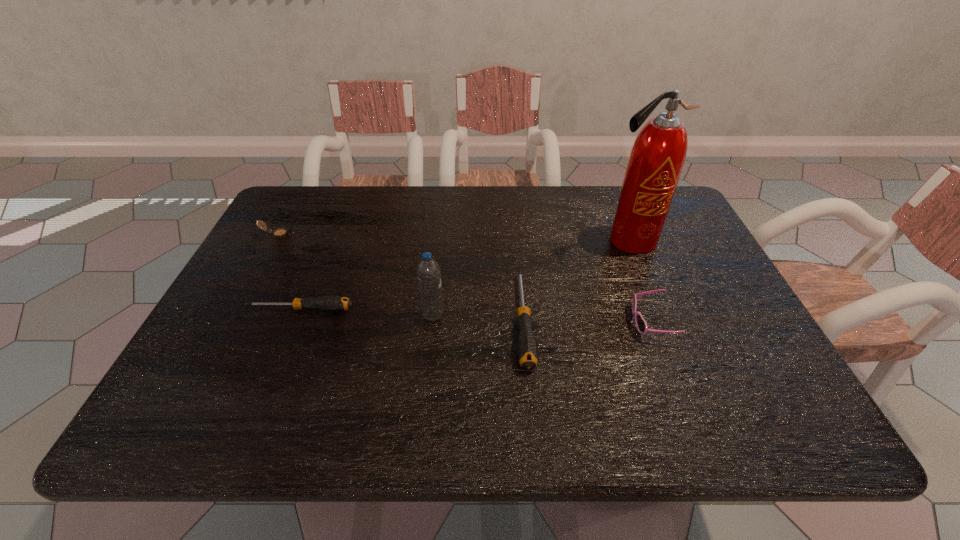
I want to click on screwdriver situated at the left edge, so click(332, 303).

Identify the location of compass located at the left edge. (282, 232).

Image resolution: width=960 pixels, height=540 pixels. Find the location of `object that is at the right edge`. object that is at the right edge is located at coordinates (657, 157).

Locate an element on the screen. object at the far left corner is located at coordinates (282, 232).

I want to click on object that is at the far right corner, so point(657,157).

This screenshot has width=960, height=540. I want to click on vacant space at the far edge of the desktop, so click(384, 219).

This screenshot has width=960, height=540. What are the coordinates of `free space at the near edge` in the screenshot? It's located at (266, 368).

In order to click on free space at the right edge in this screenshot , I will do (728, 347).

You are a GUI agent. You are given a task and a screenshot of the screen. Output one action in this format:
    pyautogui.click(x=<x>, y=<y>)
    Task: Click on the vacant area at the near left corner
    The width and height of the screenshot is (960, 540).
    Given the screenshot: What is the action you would take?
    pyautogui.click(x=233, y=376)

Find the location of a particular element. This screenshot has height=540, width=960. vacant point located between the compass and the sunglasses is located at coordinates (465, 278).